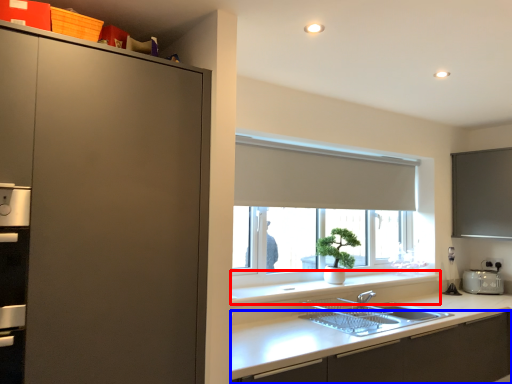
Question: Which object is further to the camera taking this photo, window sill (highlighted by a red box) or cabinetry (highlighted by a blue box)?

Choices:
 (A) window sill
 (B) cabinetry

Answer: (A)